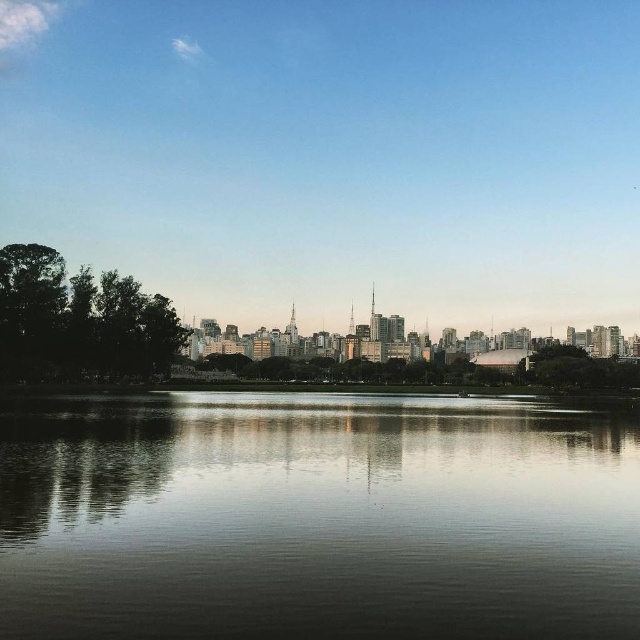
You are a photographer trying to capture the entire scene in one shot. Given that your camera can only focus on objects within a 10m width, will the smooth reflective water at center and the green leafy tree at right both fit within the camera frame?

The smooth reflective water at center is wider than the green leafy tree at right. Since the camera can focus on objects within a 10m width, both objects will fit within the frame as long as their combined width does not exceed 10m. However, the exact fit depends on their individual widths and spacing between them, which are not provided.

You are standing on a bridge overlooking the smooth reflective water at center and the green leafy tree at right. Which object appears larger in the scene?

The green leafy tree at right appears larger than the smooth reflective water at center in the scene.